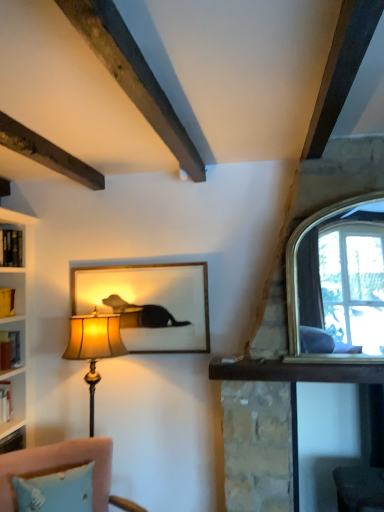
Locate an element on the screen. This screenshot has width=384, height=512. blank space situated above matte glass picture frame at center (from a real-world perspective) is located at coordinates (135, 263).